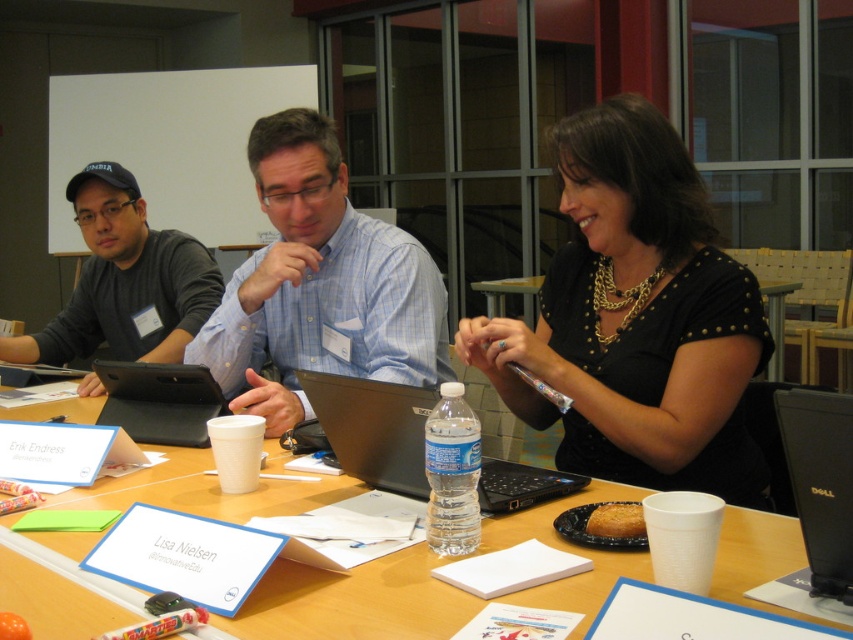
You are an event organizer who needs to place a new decorative vase on the table. The vase is 15 cm tall. Considering the clear plastic water bottle at center and the black matte table at center, can you determine if the vase will fit on the table without exceeding its height?

The clear plastic water bottle at center is shorter than the black matte table at center, which means the table is taller than 15 cm. Therefore, the vase can be placed on the table as its height is within the table height limit.

You are organizing a presentation and need to place a name tag on the table. The name tag is the size of the black plastic computer at lower right. Can you fit it next to the black studded blouse at center without overlapping?

The black studded blouse at center is larger in size than the black plastic computer at lower right, so the name tag would fit next to it without overlapping.